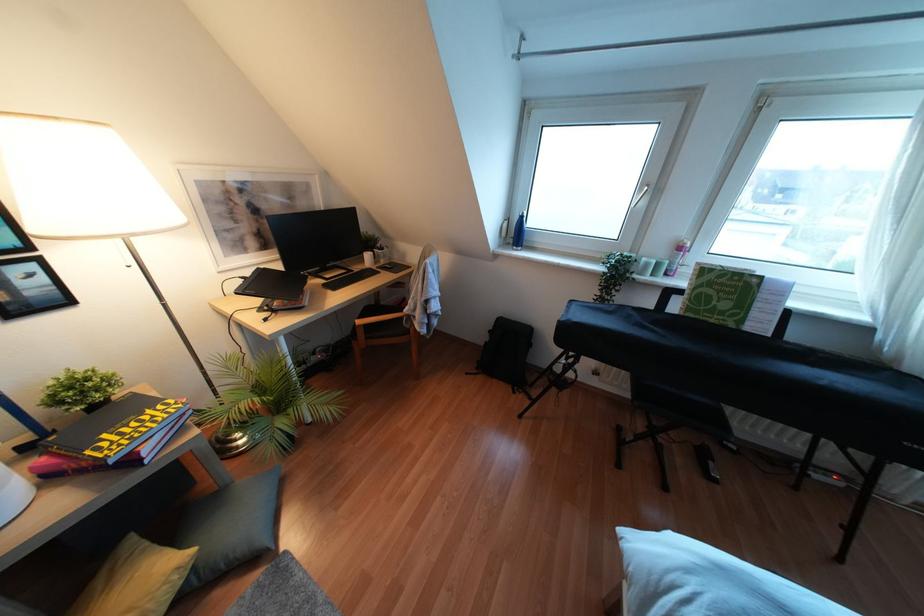
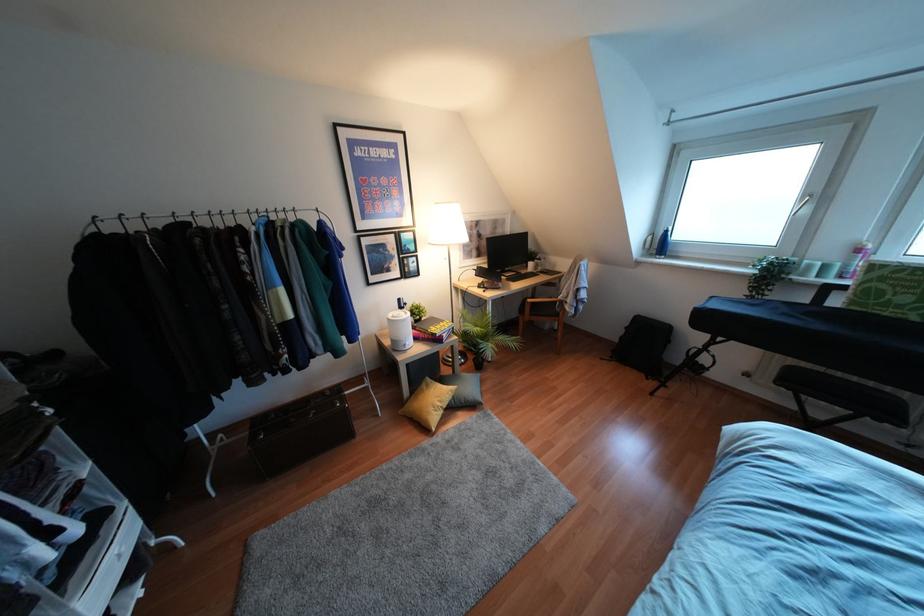
Locate, in the second image, the point that corresponds to (x=516, y=233) in the first image.

(660, 245)